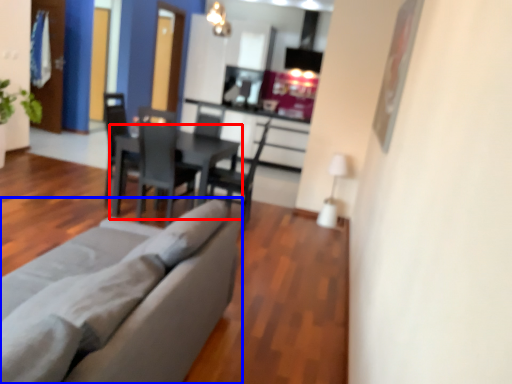
Question: Which object is further to the camera taking this photo, table (highlighted by a red box) or studio couch (highlighted by a blue box)?

Choices:
 (A) table
 (B) studio couch

Answer: (A)